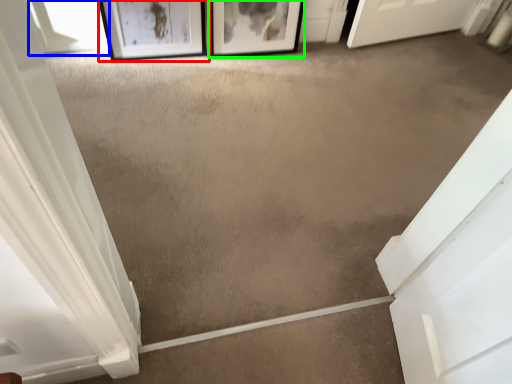
Question: Which object is the closest to the picture frame (highlighted by a red box)? Choose among these: window (highlighted by a blue box) or picture frame (highlighted by a green box).

Choices:
 (A) window
 (B) picture frame

Answer: (A)